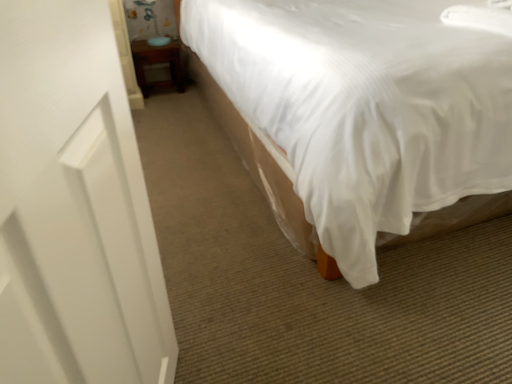
Question: From a real-world perspective, is white fabric bed at center on wooden table at lower left?

Choices:
 (A) no
 (B) yes

Answer: (B)

Question: From the image's perspective, is white fabric bed at center located beneath wooden table at lower left?

Choices:
 (A) no
 (B) yes

Answer: (B)

Question: Can you confirm if white fabric bed at center is wider than wooden table at lower left?

Choices:
 (A) yes
 (B) no

Answer: (A)

Question: Considering the relative sizes of white fabric bed at center and wooden table at lower left in the image provided, is white fabric bed at center bigger than wooden table at lower left?

Choices:
 (A) yes
 (B) no

Answer: (A)

Question: Is white fabric bed at center not within wooden table at lower left?

Choices:
 (A) yes
 (B) no

Answer: (A)

Question: Choose the correct answer: Is white matte screen door at left inside white fabric bed at center or outside it?

Choices:
 (A) outside
 (B) inside

Answer: (A)

Question: Considering the positions of point 5,150 and point 345,72, is point 5,150 closer or farther from the camera than point 345,72?

Choices:
 (A) closer
 (B) farther

Answer: (A)

Question: From a real-world perspective, is white matte screen door at left physically located above or below white fabric bed at center?

Choices:
 (A) above
 (B) below

Answer: (A)

Question: Considering the positions of white matte screen door at left and white fabric bed at center in the image, is white matte screen door at left taller or shorter than white fabric bed at center?

Choices:
 (A) short
 (B) tall

Answer: (B)

Question: Considering the relative positions of wooden table at lower left and white fabric bed at center in the image provided, is wooden table at lower left to the left or to the right of white fabric bed at center?

Choices:
 (A) right
 (B) left

Answer: (B)

Question: From a real-world perspective, is wooden table at lower left physically located above or below white fabric bed at center?

Choices:
 (A) below
 (B) above

Answer: (A)

Question: Considering the positions of wooden table at lower left and white fabric bed at center in the image, is wooden table at lower left taller or shorter than white fabric bed at center?

Choices:
 (A) tall
 (B) short

Answer: (B)

Question: From the image's perspective, is wooden table at lower left positioned above or below white fabric bed at center?

Choices:
 (A) below
 (B) above

Answer: (B)

Question: From the image's perspective, is white fabric bed at center above or below wooden table at lower left?

Choices:
 (A) below
 (B) above

Answer: (A)

Question: Considering the positions of white fabric bed at center and wooden table at lower left in the image, is white fabric bed at center wider or thinner than wooden table at lower left?

Choices:
 (A) wide
 (B) thin

Answer: (A)